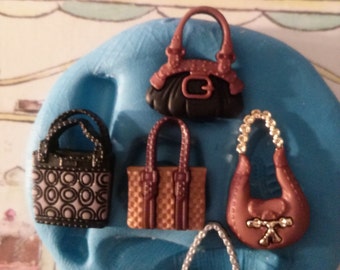
Identify the location of ornamentation. The image size is (340, 270). (270, 225).